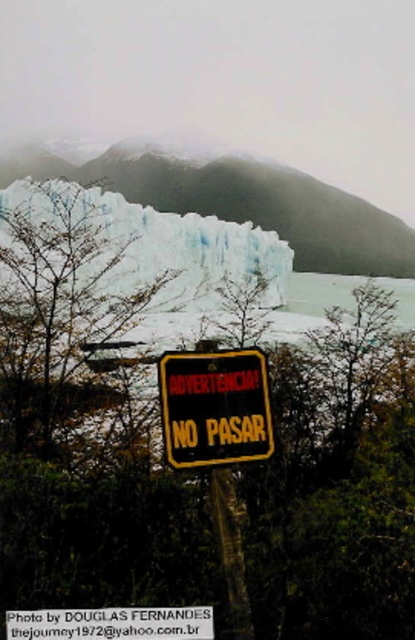
Question: Which is farther from the white ice at center?

Choices:
 (A) yellow matte sign at center
 (B) white ice glacier at upper center

Answer: (B)

Question: In this image, where is white ice glacier at upper center located relative to white ice at center?

Choices:
 (A) right
 (B) left

Answer: (B)

Question: Which point is closer to the camera?

Choices:
 (A) white ice at center
 (B) white ice glacier at upper center
 (C) yellow matte sign at center

Answer: (C)

Question: Which object is farther from the camera taking this photo?

Choices:
 (A) yellow matte sign at center
 (B) white ice at center

Answer: (B)

Question: Does white ice glacier at upper center appear on the left side of white ice at center?

Choices:
 (A) yes
 (B) no

Answer: (A)

Question: Is white ice at center behind yellow matte sign at center?

Choices:
 (A) yes
 (B) no

Answer: (A)